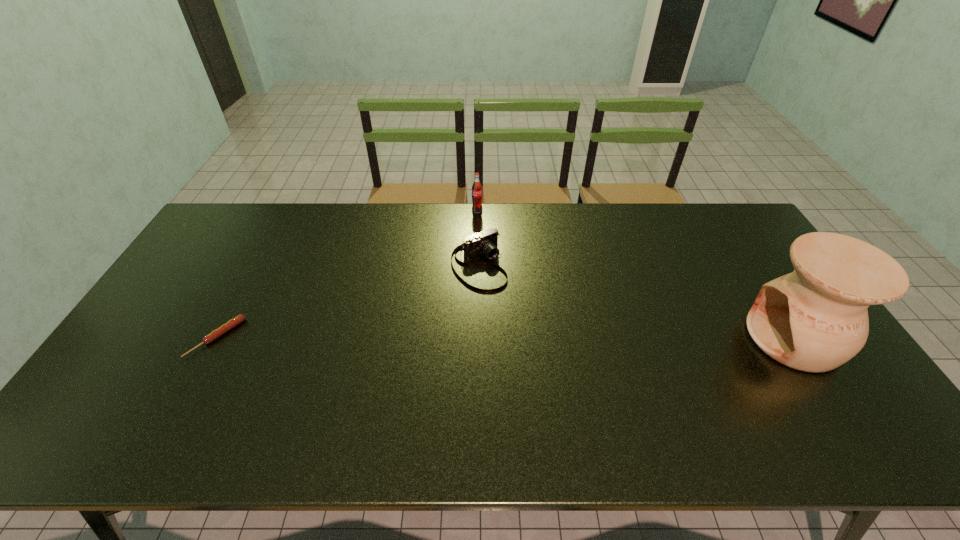
What are the coordinates of `sausage` in the screenshot? It's located at (218, 332).

The width and height of the screenshot is (960, 540). Find the location of `the shortest object`. the shortest object is located at coordinates (218, 332).

This screenshot has height=540, width=960. What are the coordinates of `pottery` in the screenshot? It's located at (815, 319).

The height and width of the screenshot is (540, 960). Identify the location of the tallest object. pyautogui.click(x=815, y=319).

Identify the location of the third shortest object. (477, 187).

Where is `the farthest object`? Image resolution: width=960 pixels, height=540 pixels. the farthest object is located at coordinates (477, 187).

Find the location of a particular element. This screenshot has height=540, width=960. the third nearest object is located at coordinates (486, 242).

What are the coordinates of `camera` in the screenshot? It's located at (486, 242).

Locate an element on the screen. The width and height of the screenshot is (960, 540). vacant space located on the right of the sausage is located at coordinates (366, 338).

At what (x,y) coordinates should I click in order to perform the action: click on vacant space located at the open side of the tallest object. Please return your answer as a coordinate pair (x, y). Image resolution: width=960 pixels, height=540 pixels. Looking at the image, I should click on (621, 338).